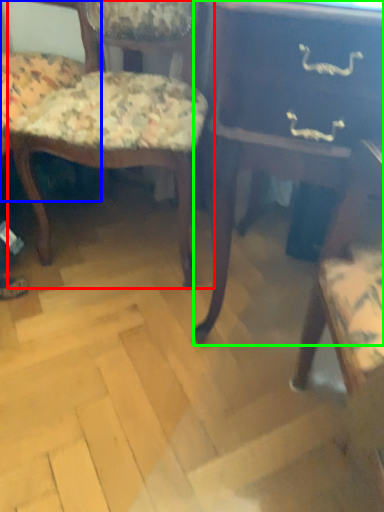
Question: Estimate the real-world distances between objects in this image. Which object is closer to chair (highlighted by a red box), chair (highlighted by a blue box) or table (highlighted by a green box)?

Choices:
 (A) chair
 (B) table

Answer: (A)